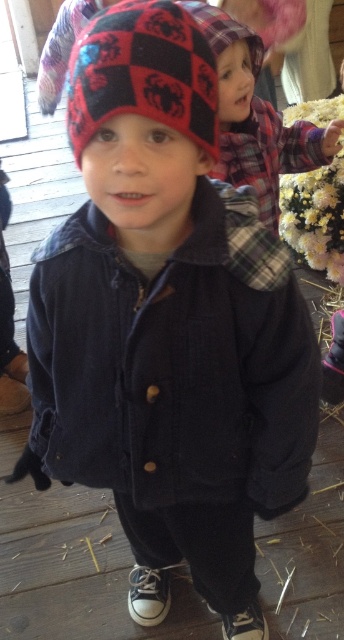
You are a photographer trying to capture both the navy corduroy jacket at center and the red checkered knit beanie at upper left in the same frame. Based on their positions, which object should you adjust your camera to focus on first to ensure both are in the shot?

The navy corduroy jacket at center is to the left of the red checkered knit beanie at upper left, so you should focus on the red checkered knit beanie at upper left first to ensure both are in frame.

You are a photographer setting up a shot of the two children in the scene. You want to ensure that the red checkered knit beanie at upper left and the plaid fabric child at upper center are both in focus. Given that your camera can only focus on objects within a 30 cm width range, will both objects fit within this range?

The red checkered knit beanie at upper left is narrower than the plaid fabric child at upper center. Since the camera requires a 30 cm width range to focus on both, but the exact widths aren